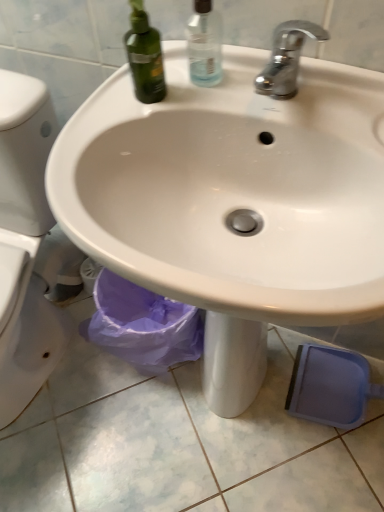
Question: Is chrome metallic faucet at upper center taller than transparent plastic spray bottle at upper center?

Choices:
 (A) no
 (B) yes

Answer: (A)

Question: Can you confirm if chrome metallic faucet at upper center is bigger than transparent plastic spray bottle at upper center?

Choices:
 (A) no
 (B) yes

Answer: (B)

Question: Can you confirm if chrome metallic faucet at upper center is wider than transparent plastic spray bottle at upper center?

Choices:
 (A) yes
 (B) no

Answer: (A)

Question: From a real-world perspective, is chrome metallic faucet at upper center located higher than transparent plastic spray bottle at upper center?

Choices:
 (A) no
 (B) yes

Answer: (A)

Question: Is chrome metallic faucet at upper center looking in the opposite direction of transparent plastic spray bottle at upper center?

Choices:
 (A) no
 (B) yes

Answer: (A)

Question: Is chrome metallic faucet at upper center facing towards transparent plastic spray bottle at upper center?

Choices:
 (A) no
 (B) yes

Answer: (A)

Question: Is transparent plastic spray bottle at upper center turned away from chrome metallic faucet at upper center?

Choices:
 (A) no
 (B) yes

Answer: (A)

Question: From a real-world perspective, is transparent plastic spray bottle at upper center below chrome metallic faucet at upper center?

Choices:
 (A) yes
 (B) no

Answer: (B)

Question: From a real-world perspective, is transparent plastic spray bottle at upper center positioned over chrome metallic faucet at upper center based on gravity?

Choices:
 (A) no
 (B) yes

Answer: (B)

Question: Are transparent plastic spray bottle at upper center and chrome metallic faucet at upper center beside each other?

Choices:
 (A) yes
 (B) no

Answer: (B)

Question: Is transparent plastic spray bottle at upper center not inside chrome metallic faucet at upper center?

Choices:
 (A) no
 (B) yes

Answer: (B)

Question: Is transparent plastic spray bottle at upper center positioned before chrome metallic faucet at upper center?

Choices:
 (A) no
 (B) yes

Answer: (A)

Question: Is chrome metallic faucet at upper center to the right of white glossy sink at center from the viewer's perspective?

Choices:
 (A) yes
 (B) no

Answer: (A)